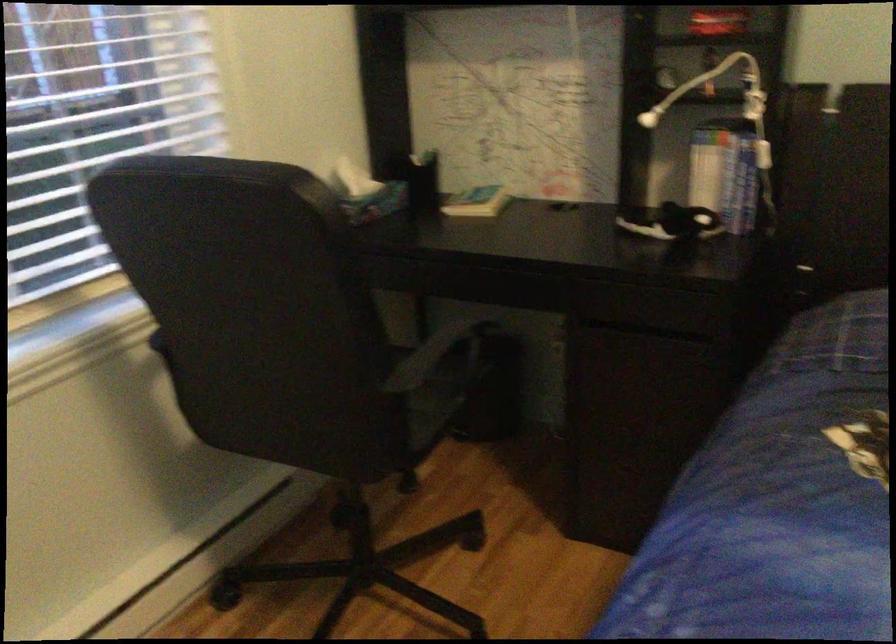
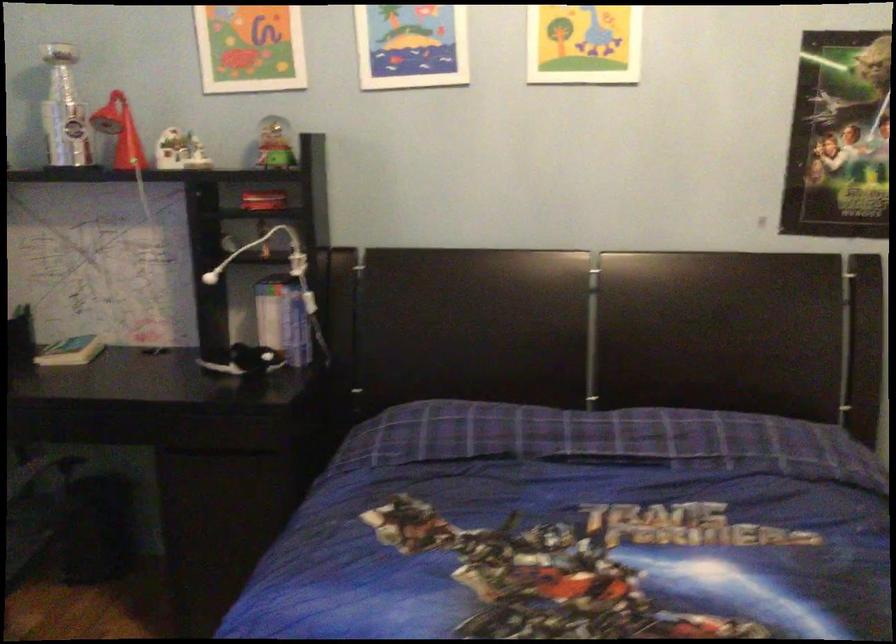
Question: How did the camera likely rotate?

Choices:
 (A) Left
 (B) Right
 (C) Up
 (D) Down

Answer: (B)